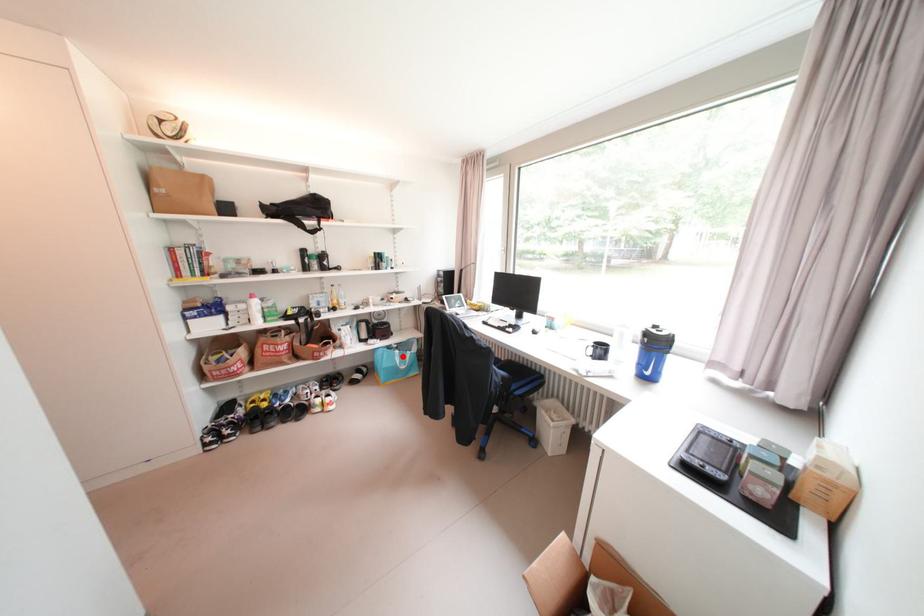
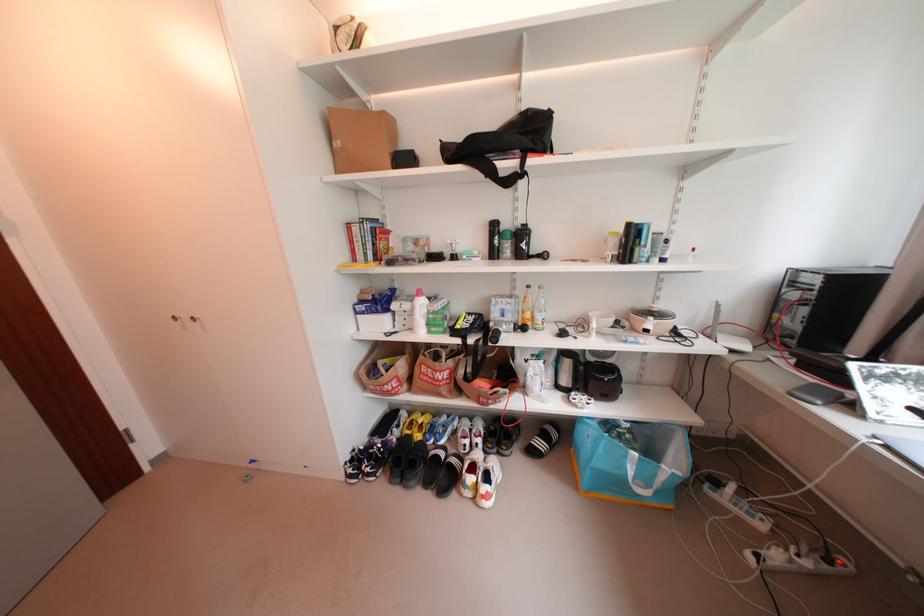
The point at the highlighted location is marked in the first image. Where is the corresponding point in the second image?

(634, 458)